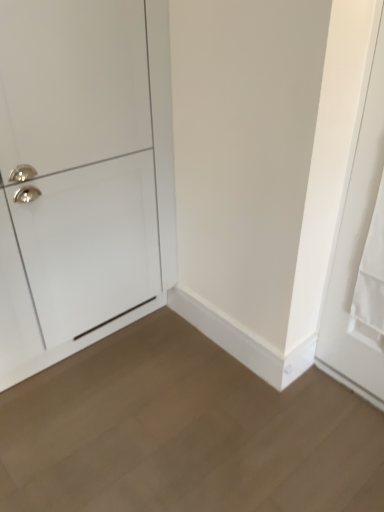
The height and width of the screenshot is (512, 384). What do you see at coordinates (82, 175) in the screenshot? I see `white glossy cabinet at left, the second door in the right-to-left sequence` at bounding box center [82, 175].

The width and height of the screenshot is (384, 512). I want to click on white matte door at right, the first door when ordered from right to left, so click(x=360, y=255).

From their relative heights in the image, would you say white matte door at right, the first door when ordered from right to left, is taller or shorter than white glossy cabinet at left, the second door in the right-to-left sequence?

white matte door at right, the first door when ordered from right to left, is shorter than white glossy cabinet at left, the second door in the right-to-left sequence.

From the image's perspective, is white matte door at right, the first door when ordered from right to left, located above or below white glossy cabinet at left, the second door in the right-to-left sequence?

white matte door at right, the first door when ordered from right to left, is below white glossy cabinet at left, the second door in the right-to-left sequence.

Are white matte door at right, the second door positioned from the left, and white glossy cabinet at left, the first door from the left, located far from each other?

That's not correct — white matte door at right, the second door positioned from the left, is a little close to white glossy cabinet at left, the first door from the left.

Is white matte door at right, the first door when ordered from right to left, oriented away from white glossy cabinet at left, the first door from the left?

white matte door at right, the first door when ordered from right to left, does not have its back to white glossy cabinet at left, the first door from the left.

Which is nearer, (144,353) or (43,158)?

Point (144,353) is positioned farther from the camera compared to point (43,158).

Is light brown wood floor at lower center to the right of white glossy cabinet at left, the first door from the left, from the viewer's perspective?

Yes.

Considering the sizes of objects light brown wood floor at lower center and white glossy cabinet at left, the first door from the left, in the image provided, who is thinner, light brown wood floor at lower center or white glossy cabinet at left, the first door from the left,?

Thinner between the two is white glossy cabinet at left, the first door from the left.

From a real-world perspective, is light brown wood floor at lower center located beneath white glossy cabinet at left, the first door from the left?

Indeed, from a real-world perspective, light brown wood floor at lower center is positioned beneath white glossy cabinet at left, the first door from the left.

Based on the photo, is white matte door at right, the first door when ordered from right to left, situated inside light brown wood floor at lower center or outside?

The correct answer is: outside.

How many degrees apart are the facing directions of white matte door at right, the first door when ordered from right to left, and light brown wood floor at lower center?

They differ by 0.0064 degrees in their facing directions.

Is point (373, 219) closer or farther from the camera than point (121, 372)?

Point (373, 219).

Where is `plain that appears below the white matte door at right, the first door when ordered from right to left (from a real-world perspective)`? plain that appears below the white matte door at right, the first door when ordered from right to left (from a real-world perspective) is located at coordinates (184, 432).

Can you confirm if white glossy cabinet at left, the second door in the right-to-left sequence, is wider than light brown wood floor at lower center?

No, white glossy cabinet at left, the second door in the right-to-left sequence, is not wider than light brown wood floor at lower center.

Is white glossy cabinet at left, the first door from the left, situated inside light brown wood floor at lower center or outside?

white glossy cabinet at left, the first door from the left, is located beyond the bounds of light brown wood floor at lower center.

From the image's perspective, is white glossy cabinet at left, the first door from the left, below light brown wood floor at lower center?

Incorrect, from the image's perspective, white glossy cabinet at left, the first door from the left, is higher than light brown wood floor at lower center.

Between point (92, 87) and point (240, 436), which one is positioned in front?

The point (92, 87) is more forward.

Which is behind, light brown wood floor at lower center or white matte door at right, the second door positioned from the left?

white matte door at right, the second door positioned from the left, is more distant.

Would you say light brown wood floor at lower center is a long distance from white matte door at right, the second door positioned from the left?

That's not correct — light brown wood floor at lower center is a little close to white matte door at right, the second door positioned from the left.

Does light brown wood floor at lower center have a greater height compared to white matte door at right, the first door when ordered from right to left?

Incorrect, the height of light brown wood floor at lower center is not larger of that of white matte door at right, the first door when ordered from right to left.

Measure the distance from light brown wood floor at lower center to white matte door at right, the second door positioned from the left.

light brown wood floor at lower center is 25.78 inches from white matte door at right, the second door positioned from the left.

Is point (81, 244) more distant than point (365, 129)?

Yes.

Consider the image. Between white glossy cabinet at left, the first door from the left, and white matte door at right, the second door positioned from the left, which one has less height?

With less height is white matte door at right, the second door positioned from the left.

Could you tell me if white glossy cabinet at left, the first door from the left, is facing white matte door at right, the second door positioned from the left?

Yes, white glossy cabinet at left, the first door from the left, is oriented towards white matte door at right, the second door positioned from the left.

Which object is closer to the camera taking this photo, white glossy cabinet at left, the second door in the right-to-left sequence, or white matte door at right, the second door positioned from the left?

white matte door at right, the second door positioned from the left, is more forward.

This screenshot has width=384, height=512. In the image, there is a white matte door at right, the second door positioned from the left. In order to click on door below it (from a real-world perspective) in this screenshot , I will do `click(82, 175)`.

From a real-world perspective, count 1st doors upward from the light brown wood floor at lower center and point to it. Please provide its 2D coordinates.

[(82, 175)]

Considering their positions, is white glossy cabinet at left, the second door in the right-to-left sequence, positioned further to light brown wood floor at lower center than white matte door at right, the first door when ordered from right to left?

Among the two, white glossy cabinet at left, the second door in the right-to-left sequence, is located further to light brown wood floor at lower center.

Looking at the image, which one is located further to white glossy cabinet at left, the first door from the left, light brown wood floor at lower center or white matte door at right, the second door positioned from the left?

white matte door at right, the second door positioned from the left, is positioned further to the anchor white glossy cabinet at left, the first door from the left.

From the image, which object appears to be farther from white glossy cabinet at left, the first door from the left, white matte door at right, the second door positioned from the left, or light brown wood floor at lower center?

The object further to white glossy cabinet at left, the first door from the left, is white matte door at right, the second door positioned from the left.

From the image, which object appears to be farther from white matte door at right, the first door when ordered from right to left, light brown wood floor at lower center or white glossy cabinet at left, the second door in the right-to-left sequence?

white glossy cabinet at left, the second door in the right-to-left sequence.

Consider the image. Looking at the image, which one is located further to light brown wood floor at lower center, white matte door at right, the second door positioned from the left, or white glossy cabinet at left, the second door in the right-to-left sequence?

Result: Among the two, white glossy cabinet at left, the second door in the right-to-left sequence, is located further to light brown wood floor at lower center.

From the image, which object appears to be nearer to white matte door at right, the second door positioned from the left, white glossy cabinet at left, the second door in the right-to-left sequence, or light brown wood floor at lower center?

light brown wood floor at lower center lies closer to white matte door at right, the second door positioned from the left, than the other object.

Locate an element on the screen. This screenshot has height=512, width=384. plain between white glossy cabinet at left, the second door in the right-to-left sequence, and white matte door at right, the first door when ordered from right to left, in the horizontal direction is located at coordinates (184, 432).